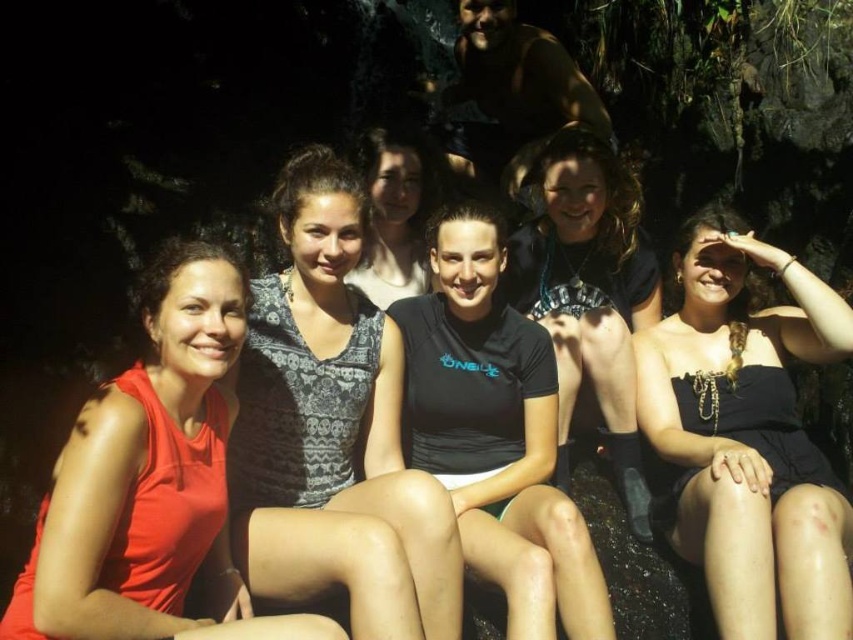
Question: Estimate the real-world distances between objects in this image. Which object is closer to the matte red tank top at left?

Choices:
 (A) matte black tank top at center
 (B) black matte shirt at center

Answer: (B)

Question: Can you confirm if patterned fabric dress at center is positioned below black matte tank top at center?

Choices:
 (A) yes
 (B) no

Answer: (A)

Question: In this image, where is black satin dress at lower right located relative to matte red tank top at left?

Choices:
 (A) right
 (B) left

Answer: (A)

Question: Does patterned fabric dress at center appear under black matte shirt at center?

Choices:
 (A) no
 (B) yes

Answer: (A)

Question: Which object appears closest to the camera in this image?

Choices:
 (A) black matte shirt at center
 (B) patterned fabric dress at center
 (C) black matte tank top at center

Answer: (B)

Question: Which object is positioned farthest from the matte black tank top at center?

Choices:
 (A) matte red tank top at left
 (B) black matte shirt at center
 (C) black matte tank top at center

Answer: (A)